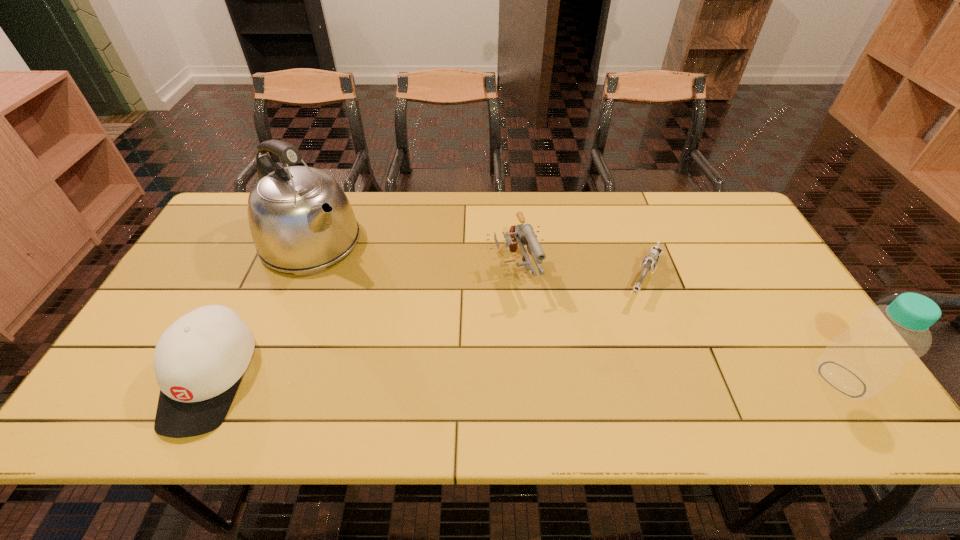
Find the location of `the fourth tallest object`. the fourth tallest object is located at coordinates (199, 361).

Where is `the rightmost object`? the rightmost object is located at coordinates (859, 363).

Find the location of a particular element. The image size is (960, 540). the second tallest object is located at coordinates (859, 363).

In order to click on the third object from left to right in this screenshot , I will do `click(521, 234)`.

This screenshot has height=540, width=960. In order to click on the taller gun in this screenshot , I will do 521,234.

I want to click on the right gun, so click(x=650, y=261).

The image size is (960, 540). Identify the location of the shorter gun. (650, 261).

The image size is (960, 540). Find the location of `kettle`. kettle is located at coordinates (301, 221).

Where is `vacant region located 0.120m on the left of the fourth shortest object`? This screenshot has width=960, height=540. vacant region located 0.120m on the left of the fourth shortest object is located at coordinates (765, 379).

In order to click on free space located at the barrel end of the third object from left to right in this screenshot , I will do `click(545, 355)`.